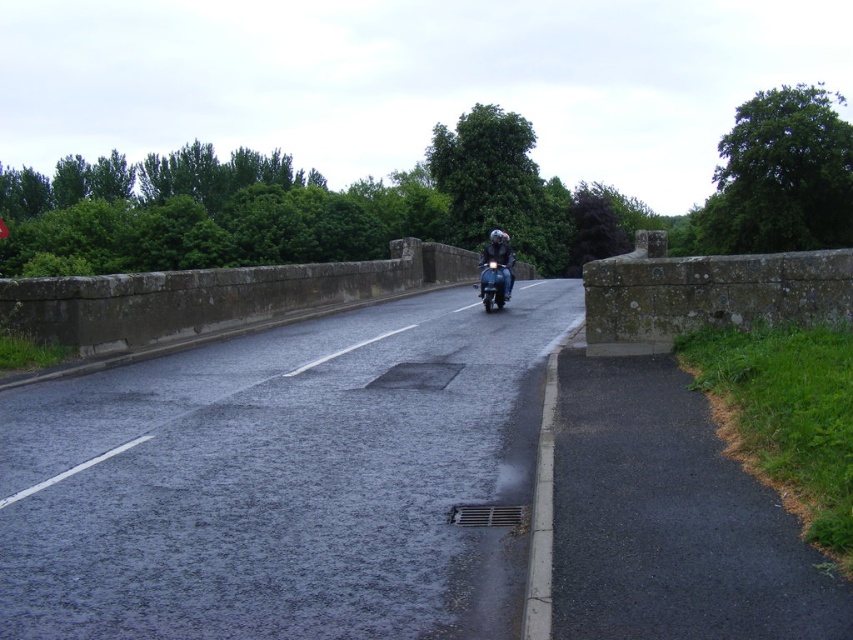
Which is above, glossy asphalt road at center or shiny black helmet at center?

shiny black helmet at center is higher up.

Between glossy asphalt road at center and shiny black helmet at center, which one has less height?

glossy asphalt road at center

The width and height of the screenshot is (853, 640). I want to click on glossy asphalt road at center, so 280,477.

Is shiny black helmet at center smaller than glossy black motorcycle at center?

Actually, shiny black helmet at center might be larger than glossy black motorcycle at center.

Can you confirm if shiny black helmet at center is wider than glossy black motorcycle at center?

Yes.

Is point (480, 259) positioned after point (502, 289)?

Yes.

This screenshot has width=853, height=640. In order to click on shiny black helmet at center in this screenshot , I will do click(x=496, y=269).

Looking at this image, who is lower down, glossy asphalt road at center or glossy black motorcycle at center?

glossy asphalt road at center is below.

Image resolution: width=853 pixels, height=640 pixels. Identify the location of glossy asphalt road at center. (280, 477).

Is point (51, 472) in front of point (486, 272)?

Yes, point (51, 472) is closer to viewer.

The width and height of the screenshot is (853, 640). Find the location of `glossy asphalt road at center`. glossy asphalt road at center is located at coordinates (280, 477).